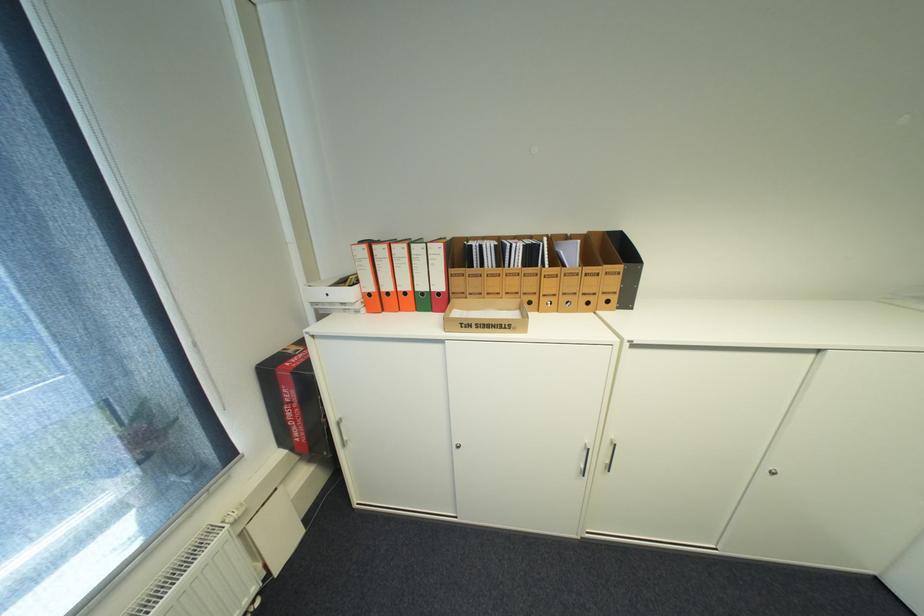
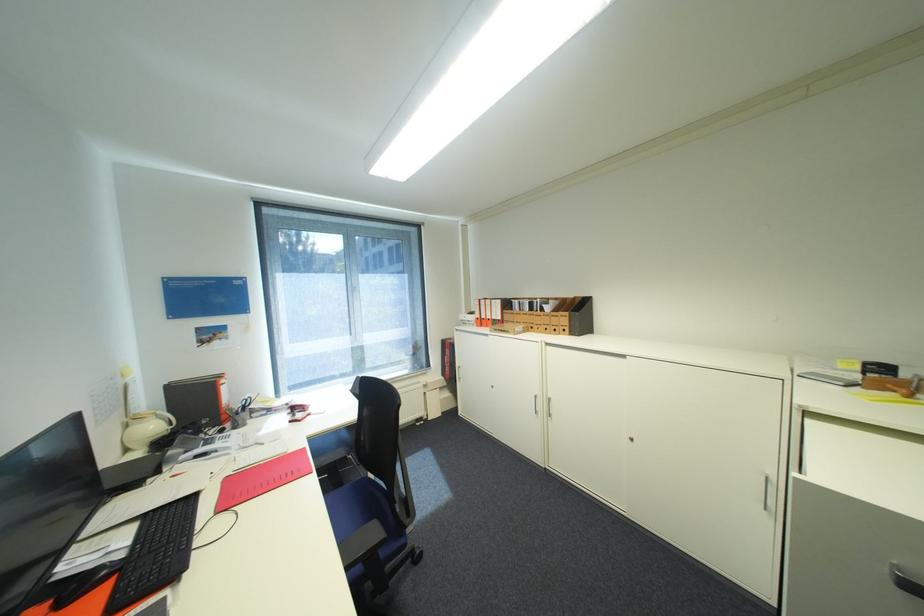
Locate, in the second image, the point that corresponds to (x=378, y=294) in the first image.

(485, 318)